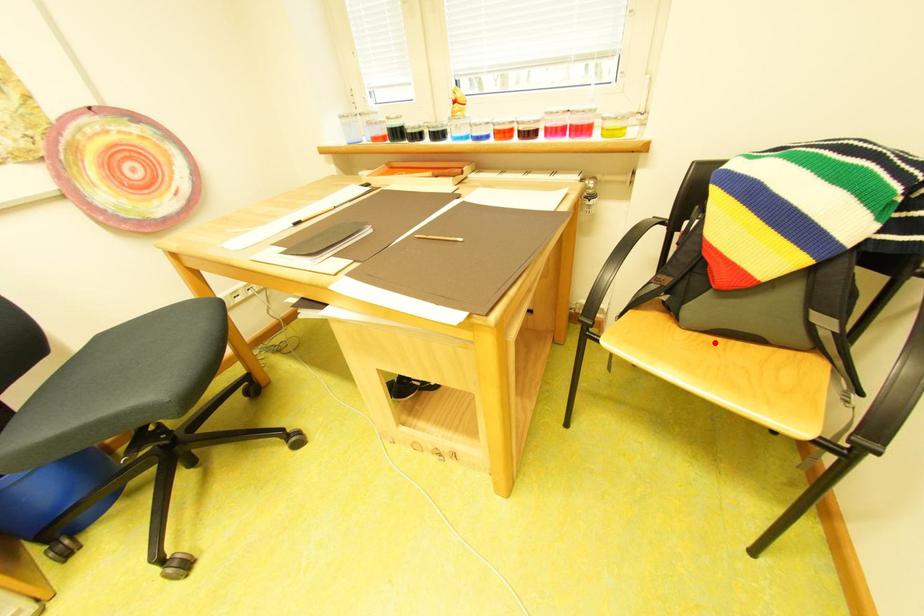
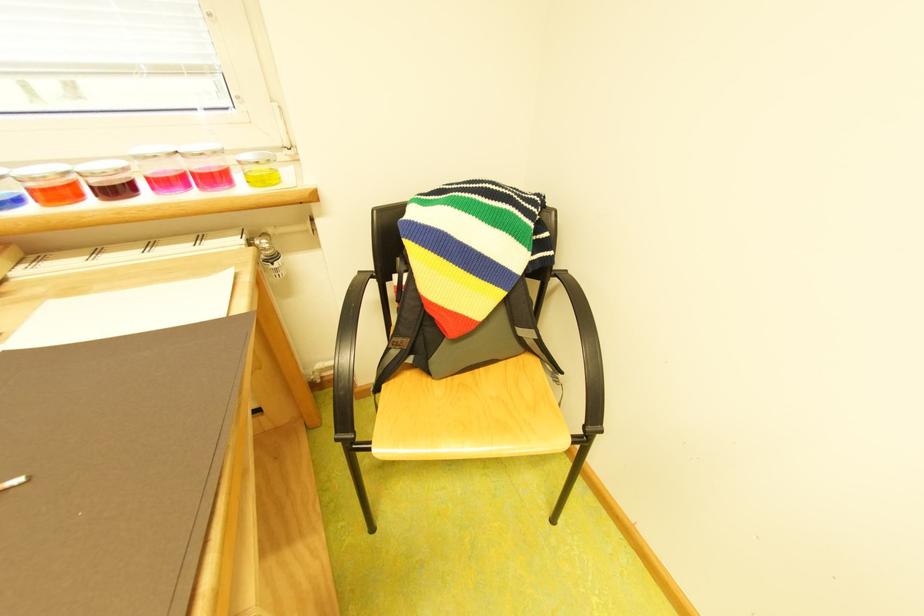
In the second image, find the point that corresponds to the highlighted location in the first image.

(469, 387)